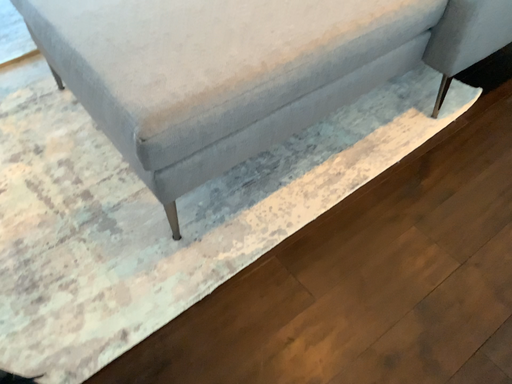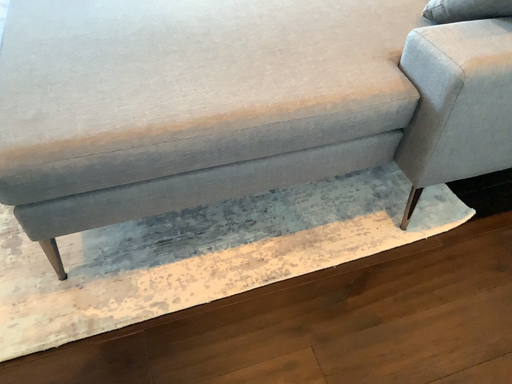
Question: How did the camera likely rotate when shooting the video?

Choices:
 (A) rotated right
 (B) rotated left

Answer: (B)